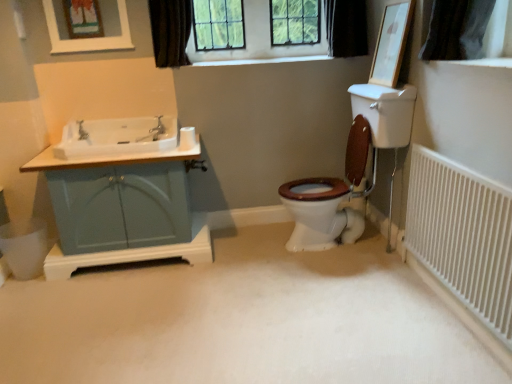
You are a GUI agent. You are given a task and a screenshot of the screen. Output one action in this format:
    pyautogui.click(x=<x>, y=<y>)
    Task: Click on the vacant space to the left of brushed metal faucet at left
    The image size is (512, 384).
    Given the screenshot: What is the action you would take?
    pyautogui.click(x=70, y=139)